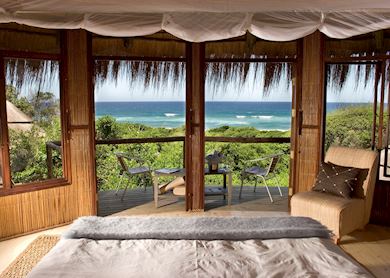
Locate an element on the screen. The height and width of the screenshot is (278, 390). chair is located at coordinates (344, 219).